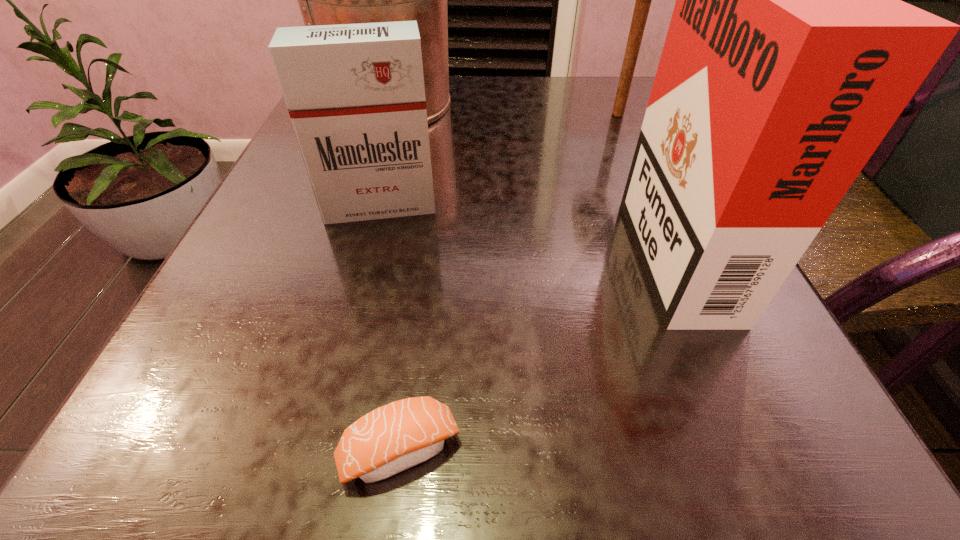
Find the location of `empty space that is in between the shortest object and the bucket`. empty space that is in between the shortest object and the bucket is located at coordinates (396, 277).

Identify the location of vacant point located between the mallet and the sushi. The width and height of the screenshot is (960, 540). (509, 282).

The height and width of the screenshot is (540, 960). Find the location of `vacant region between the bucket and the right cigarette case`. vacant region between the bucket and the right cigarette case is located at coordinates (530, 173).

Locate an element on the screen. vacant region between the second shortest object and the mallet is located at coordinates (499, 160).

This screenshot has height=540, width=960. Find the location of `empty space between the bucket and the nearest object`. empty space between the bucket and the nearest object is located at coordinates (396, 277).

In order to click on vacant area that lies between the right cigarette case and the bucket in this screenshot , I will do `click(530, 173)`.

You are a GUI agent. You are given a task and a screenshot of the screen. Output one action in this format:
    pyautogui.click(x=<x>, y=<y>)
    Task: Click on the vacant space in between the mallet and the bucket
    The height and width of the screenshot is (540, 960).
    Given the screenshot: What is the action you would take?
    pyautogui.click(x=504, y=109)

Locate which object ranks fourth in proximity to the mallet. Please provide its 2D coordinates. Your answer should be formatted as a tuple, i.e. [(x, y)], where the tuple contains the x and y coordinates of a point satisfying the conditions above.

[(395, 437)]

Select which object appears as the closest to the bucket. Please provide its 2D coordinates. Your answer should be formatted as a tuple, i.e. [(x, y)], where the tuple contains the x and y coordinates of a point satisfying the conditions above.

[(355, 93)]